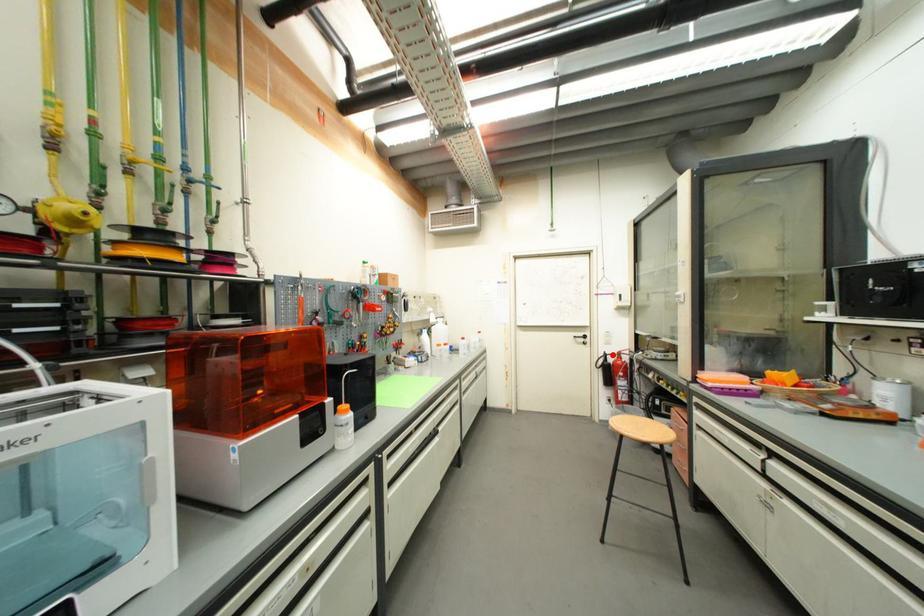
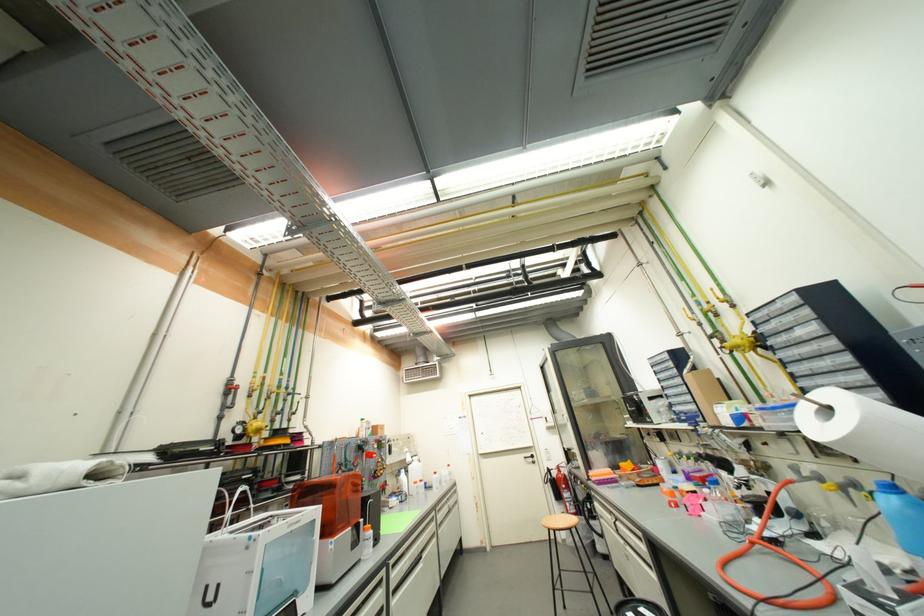
Question: I am providing you with two images of the same scene from different viewpoints. In image1, a red point is highlighted. Considering the same 3D point in image2, which of the following is correct?

Choices:
 (A) It is closer
 (B) It is farther

Answer: (B)